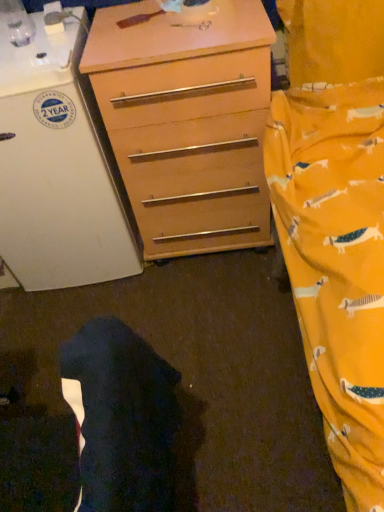
This screenshot has width=384, height=512. What are the coordinates of `white matte refrigerator at left` in the screenshot? It's located at (59, 170).

Image resolution: width=384 pixels, height=512 pixels. Describe the element at coordinates (121, 418) in the screenshot. I see `dark fabric robe at lower left` at that location.

Where is `wooden chest of drawers at center`? Image resolution: width=384 pixels, height=512 pixels. wooden chest of drawers at center is located at coordinates (187, 123).

Would you say white matte refrigerator at left is outside wooden chest of drawers at center?

Yes.

Is white matte refrigerator at left smaller than wooden chest of drawers at center?

Actually, white matte refrigerator at left might be larger than wooden chest of drawers at center.

Which point is more distant from viewer, (112, 164) or (268, 199)?

The point (268, 199) is farther from the camera.

From a real-world perspective, is wooden chest of drawers at center on dark fabric robe at lower left?

No, from a real-world perspective, wooden chest of drawers at center is not above dark fabric robe at lower left.

Is wooden chest of drawers at center bigger than dark fabric robe at lower left?

Correct, wooden chest of drawers at center is larger in size than dark fabric robe at lower left.

From the image's perspective, would you say wooden chest of drawers at center is positioned over dark fabric robe at lower left?

Yes, from the image's perspective, wooden chest of drawers at center is above dark fabric robe at lower left.

Is wooden chest of drawers at center not close to dark fabric robe at lower left?

No, wooden chest of drawers at center is not far away from dark fabric robe at lower left.

Which object is further away from the camera, white matte refrigerator at left or dark fabric robe at lower left?

white matte refrigerator at left.

From a real-world perspective, is white matte refrigerator at left physically above dark fabric robe at lower left?

No, from a real-world perspective, white matte refrigerator at left is not on top of dark fabric robe at lower left.

Which object is thinner, white matte refrigerator at left or dark fabric robe at lower left?

dark fabric robe at lower left is thinner.

The width and height of the screenshot is (384, 512). Find the location of `appliance beneath the dark fabric robe at lower left (from a real-world perspective)`. appliance beneath the dark fabric robe at lower left (from a real-world perspective) is located at coordinates (59, 170).

How different are the orientations of wooden chest of drawers at center and white matte refrigerator at left in degrees?

There is a 0.193-degree angle between the facing directions of wooden chest of drawers at center and white matte refrigerator at left.

Is wooden chest of drawers at center touching white matte refrigerator at left?

They are not placed beside each other.

Who is bigger, wooden chest of drawers at center or white matte refrigerator at left?

white matte refrigerator at left is bigger.

Is wooden chest of drawers at center wider or thinner than white matte refrigerator at left?

Considering their sizes, wooden chest of drawers at center looks slimmer than white matte refrigerator at left.

Is dark fabric robe at lower left taller than white matte refrigerator at left?

In fact, dark fabric robe at lower left may be shorter than white matte refrigerator at left.

What are the coordinates of `appliance on the left of dark fabric robe at lower left` in the screenshot? It's located at (59, 170).

Can white matte refrigerator at left be found inside dark fabric robe at lower left?

No.

From a real-world perspective, which is physically above, dark fabric robe at lower left or white matte refrigerator at left?

From a 3D spatial view, dark fabric robe at lower left is above.

Is dark fabric robe at lower left turned away from wooden chest of drawers at center?

No, wooden chest of drawers at center is not at the back of dark fabric robe at lower left.

Considering the points (101, 331) and (155, 185), which point is in front, point (101, 331) or point (155, 185)?

Positioned in front is point (101, 331).

From the image's perspective, between dark fabric robe at lower left and wooden chest of drawers at center, which one is located above?

wooden chest of drawers at center appears higher in the image.

Identify the location of chest of drawers on the right of white matte refrigerator at left. (187, 123).

Find the location of a particular element. the chest of drawers behind the dark fabric robe at lower left is located at coordinates (187, 123).

Considering their positions, is white matte refrigerator at left positioned further to wooden chest of drawers at center than dark fabric robe at lower left?

dark fabric robe at lower left lies further to wooden chest of drawers at center than the other object.

When comparing their distances from dark fabric robe at lower left, does white matte refrigerator at left or wooden chest of drawers at center seem further?

The object further to dark fabric robe at lower left is white matte refrigerator at left.

In the scene shown: Which object lies further to the anchor point white matte refrigerator at left, dark fabric robe at lower left or wooden chest of drawers at center?

Based on the image, dark fabric robe at lower left appears to be further to white matte refrigerator at left.

When comparing their distances from dark fabric robe at lower left, does wooden chest of drawers at center or white matte refrigerator at left seem further?

white matte refrigerator at left.

When comparing their distances from white matte refrigerator at left, does wooden chest of drawers at center or dark fabric robe at lower left seem further?

Among the two, dark fabric robe at lower left is located further to white matte refrigerator at left.

Considering their positions, is dark fabric robe at lower left positioned further to wooden chest of drawers at center than white matte refrigerator at left?

The object further to wooden chest of drawers at center is dark fabric robe at lower left.

Find the location of `appliance between wooden chest of drawers at center and dark fabric robe at lower left vertically`. appliance between wooden chest of drawers at center and dark fabric robe at lower left vertically is located at coordinates (59, 170).